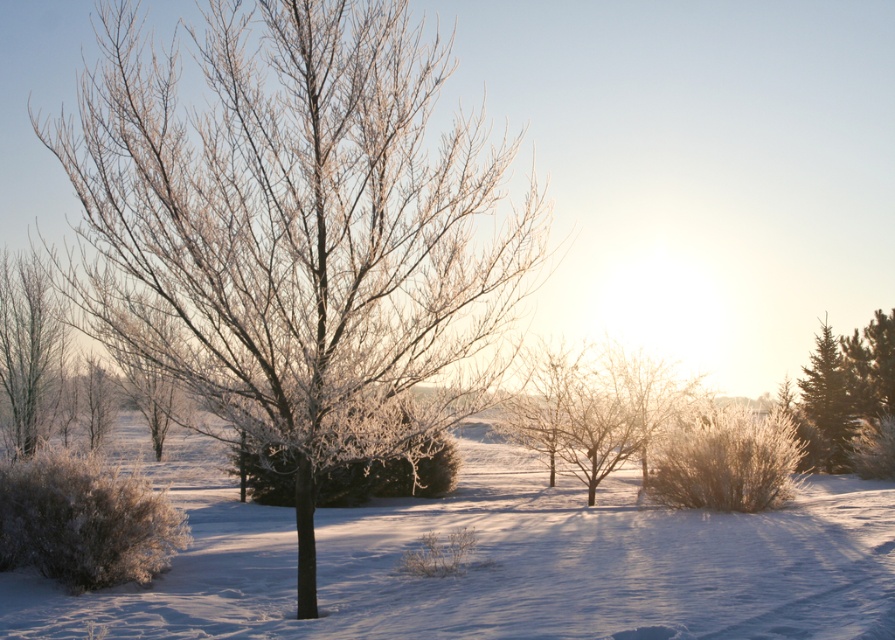
Question: Based on their relative distances, which object is nearer to the green textured evergreen at right?

Choices:
 (A) frosted bark tree at center
 (B) white fluffy snow at center

Answer: (B)

Question: Is frosted white tree at left smaller than green textured evergreen at right?

Choices:
 (A) no
 (B) yes

Answer: (A)

Question: Which object is positioned closest to the frosted bark tree at center?

Choices:
 (A) white fluffy snow at center
 (B) green textured evergreen at right
 (C) frosted white tree at left

Answer: (A)

Question: Which of the following is the farthest from the observer?

Choices:
 (A) green textured evergreen at right
 (B) white fluffy snow at center
 (C) frosted bark tree at center
 (D) frosted white tree at left

Answer: (A)

Question: Is frosted bark tree at center bigger than green textured evergreen at right?

Choices:
 (A) yes
 (B) no

Answer: (A)

Question: Observing the image, what is the correct spatial positioning of frosted white tree at left in reference to green textured evergreen at right?

Choices:
 (A) below
 (B) above

Answer: (B)